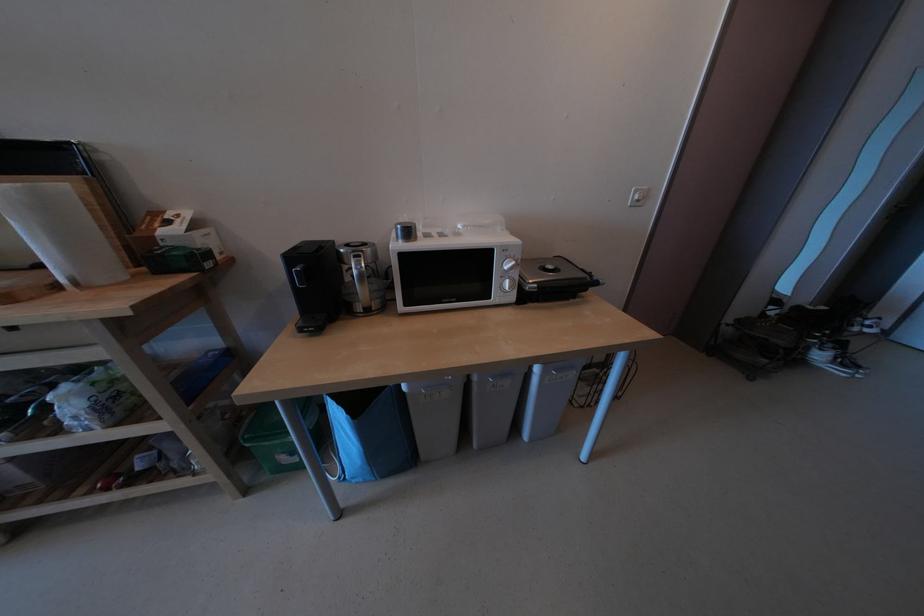
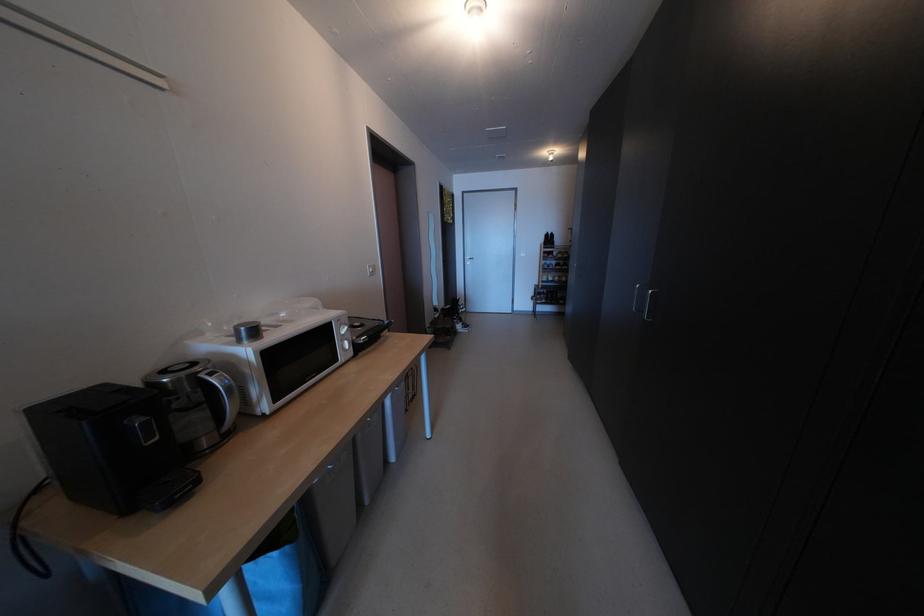
Locate, in the second image, the point that corresponds to point (369, 262) in the first image.

(225, 379)